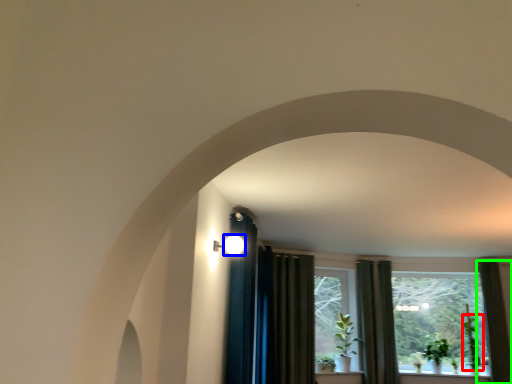
Question: Which object is the farthest from plant (highlighted by a red box)? Choose among these: light (highlighted by a blue box) or curtain (highlighted by a green box).

Choices:
 (A) light
 (B) curtain

Answer: (A)